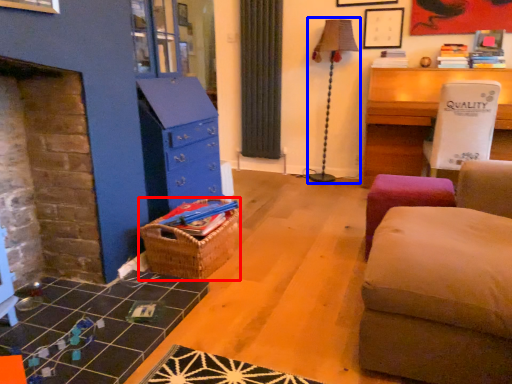
Question: Which of the following is the farthest to the observer, crate (highlighted by a red box) or table lamp (highlighted by a blue box)?

Choices:
 (A) crate
 (B) table lamp

Answer: (B)